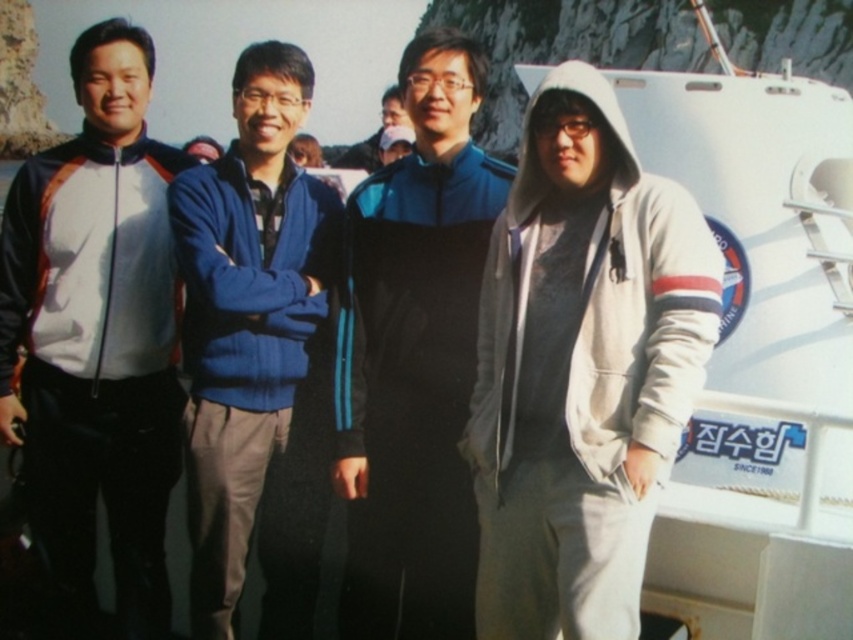
Question: Considering the real-world distances, which object is farthest from the matte black jacket at left?

Choices:
 (A) gray fleece hoodie at right
 (B) matte black jacket at center

Answer: (B)

Question: Is gray fleece hoodie at right thinner than matte black jacket at left?

Choices:
 (A) no
 (B) yes

Answer: (A)

Question: Observing the image, what is the correct spatial positioning of matte black jacket at left in reference to blue fleece jacket at center?

Choices:
 (A) below
 (B) above

Answer: (B)

Question: In this image, where is gray fleece hoodie at right located relative to matte black jacket at left?

Choices:
 (A) above
 (B) below

Answer: (B)

Question: Which object is positioned farthest from the matte black jacket at left?

Choices:
 (A) gray fleece hoodie at right
 (B) blue/black track suit at center

Answer: (A)

Question: Which point is farther from the camera taking this photo?

Choices:
 (A) (241, 269)
 (B) (521, 150)
 (C) (393, 108)

Answer: (C)